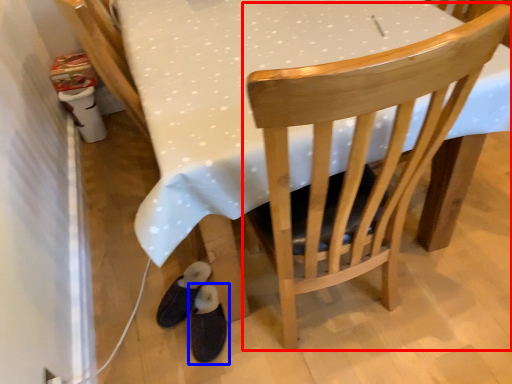
Question: Among these objects, which one is nearest to the camera, chair (highlighted by a red box) or footwear (highlighted by a blue box)?

Choices:
 (A) chair
 (B) footwear

Answer: (A)